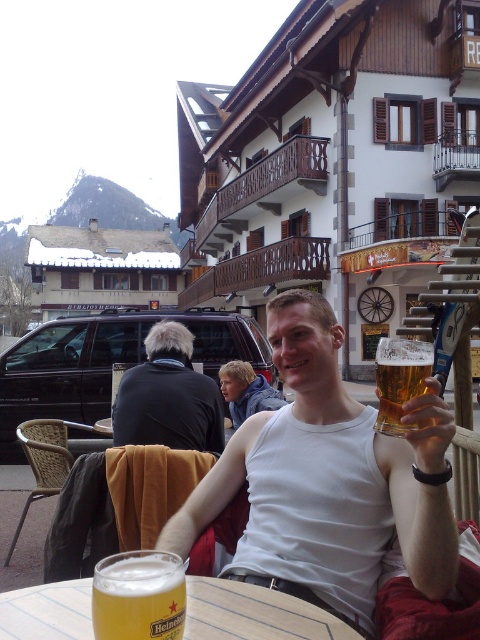
Question: Which of the following is the farthest from the observer?

Choices:
 (A) clear plastic glass at center
 (B) wooden balcony at upper center

Answer: (B)

Question: Which of the following is the closest to the observer?

Choices:
 (A) (164, 600)
 (B) (409, 349)
 (C) (39, 278)

Answer: (A)

Question: Which object is farther from the camera taking this photo?

Choices:
 (A) white tank top at center
 (B) clear plastic glass at center
 (C) dark gray sweater at left
 (D) wooden balcony at upper center

Answer: (D)

Question: Is white tank top at center thinner than golden glass heineken at lower center?

Choices:
 (A) no
 (B) yes

Answer: (A)

Question: Is clear plastic glass at center to the right of golden glass heineken at lower center from the viewer's perspective?

Choices:
 (A) yes
 (B) no

Answer: (B)

Question: Does clear plastic glass at center have a larger size compared to golden glass heineken at lower center?

Choices:
 (A) yes
 (B) no

Answer: (A)